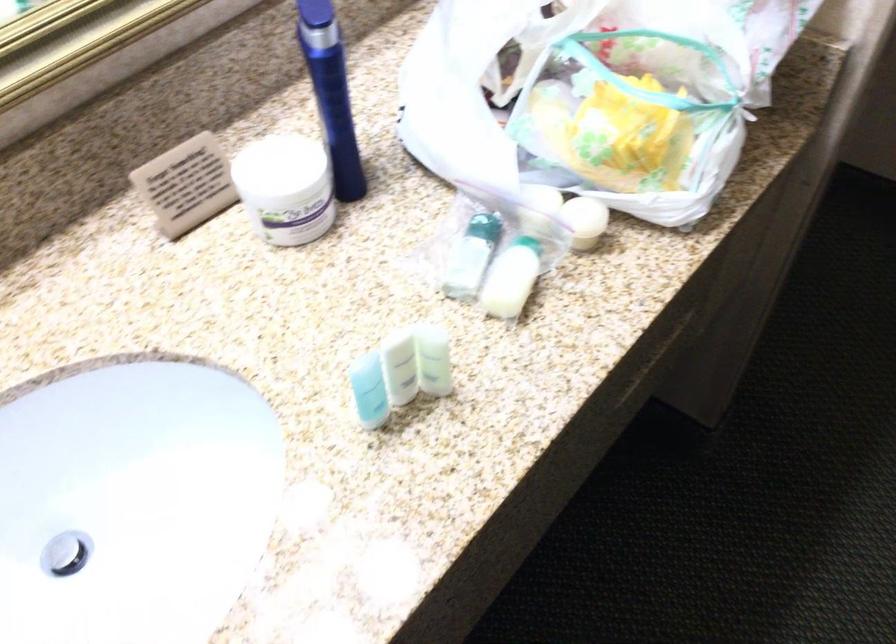
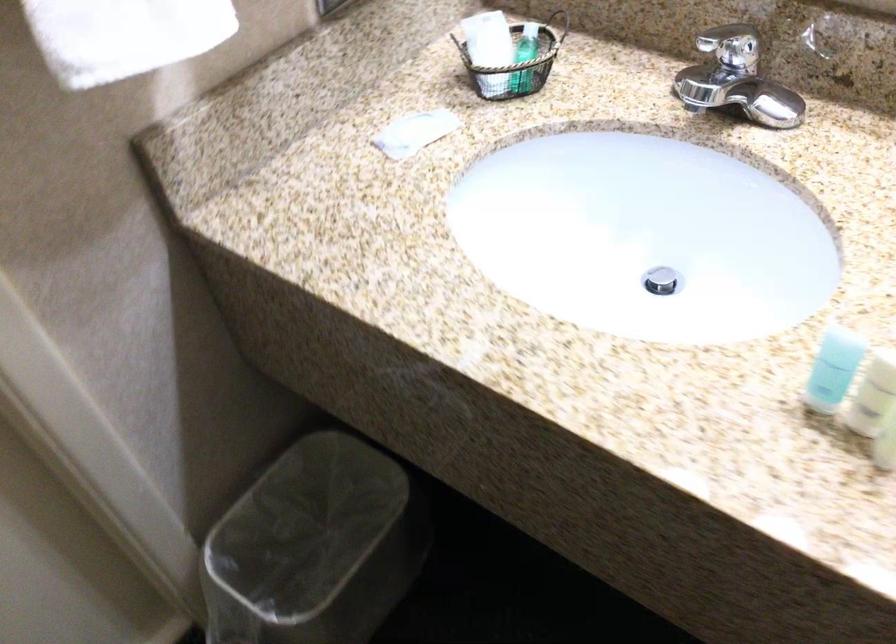
In the second image, find the point that corresponds to point 366,395 in the first image.

(833, 368)